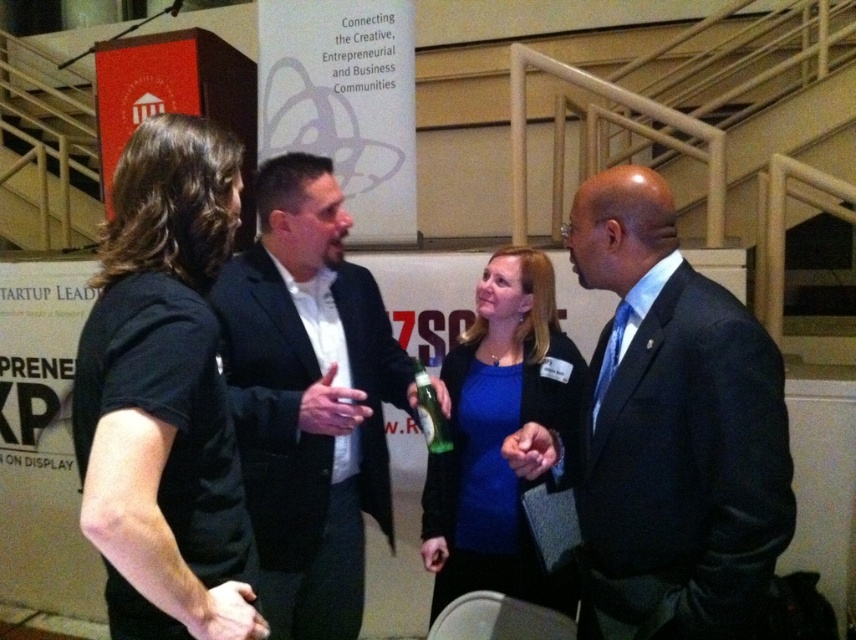
You are standing at the entrance of the event and want to approach the dark blue suit at center and the blue matte shirt at center. Which one should you walk towards first to reach the closer one?

The dark blue suit at center is closer to the viewer than the blue matte shirt at center, so you should walk towards the dark blue suit at center first.

You are organizing a photo shoot and need to arrange the dark blue suit at center and the blue matte shirt at center in a row for a group photo. If you want to place them side by side with equal spacing between each, which one should be positioned first to ensure they fit within the frame?

The dark blue suit at center should be positioned first because it has a larger width than the blue matte shirt at center, allowing more space to be allocated accordingly.

You are attending a networking event and want to approach the blue matte shirt at center and the green glass bottle at center. Which one should you walk towards first if you want to reach the one closer to you?

The blue matte shirt at center is closer to the viewer than the green glass bottle at center, so you should walk towards the blue matte shirt at center first.